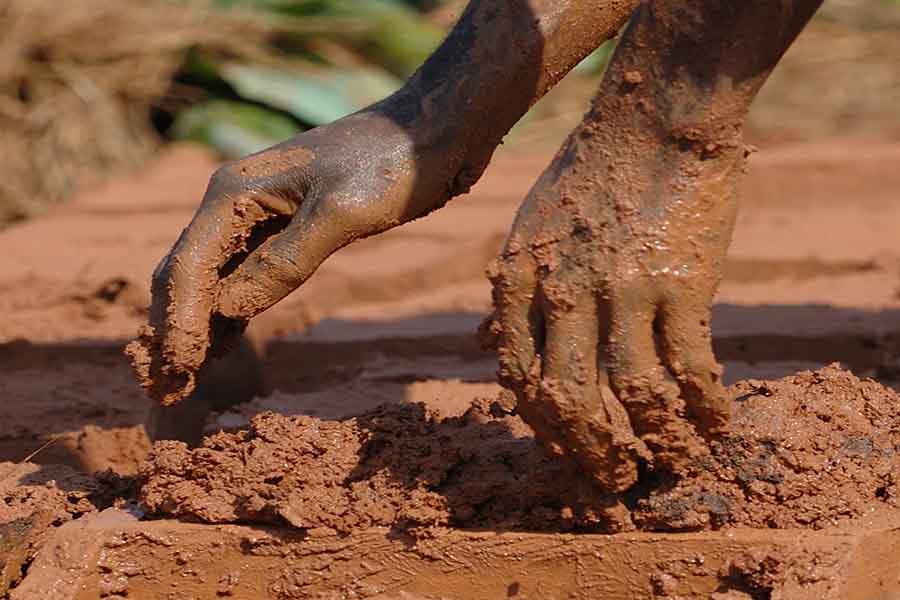
I want to click on plant, so click(x=320, y=103), click(x=388, y=35), click(x=247, y=127), click(x=590, y=70), click(x=522, y=127).